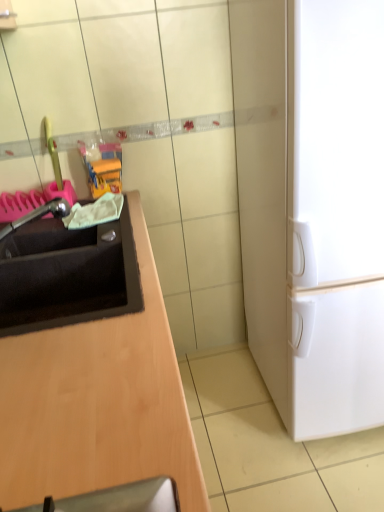
Question: From a real-world perspective, is black matte sink at left physically above white matte refrigerator at right?

Choices:
 (A) yes
 (B) no

Answer: (A)

Question: Is black matte sink at left positioned before white matte refrigerator at right?

Choices:
 (A) yes
 (B) no

Answer: (B)

Question: Is black matte sink at left smaller than white matte refrigerator at right?

Choices:
 (A) yes
 (B) no

Answer: (A)

Question: Is black matte sink at left next to white matte refrigerator at right?

Choices:
 (A) no
 (B) yes

Answer: (A)

Question: Is black matte sink at left aimed at white matte refrigerator at right?

Choices:
 (A) yes
 (B) no

Answer: (A)

Question: From a real-world perspective, relative to satin nickel faucet at left, is white matte refrigerator at right vertically above or below?

Choices:
 (A) above
 (B) below

Answer: (B)

Question: Looking at their shapes, would you say white matte refrigerator at right is wider or thinner than satin nickel faucet at left?

Choices:
 (A) wide
 (B) thin

Answer: (A)

Question: Visually, is white matte refrigerator at right positioned to the left or to the right of satin nickel faucet at left?

Choices:
 (A) left
 (B) right

Answer: (B)

Question: Does point (281, 193) appear closer or farther from the camera than point (31, 215)?

Choices:
 (A) farther
 (B) closer

Answer: (B)

Question: Considering the positions of black matte sink at left and white matte refrigerator at right in the image, is black matte sink at left taller or shorter than white matte refrigerator at right?

Choices:
 (A) short
 (B) tall

Answer: (A)

Question: From a real-world perspective, is black matte sink at left above or below white matte refrigerator at right?

Choices:
 (A) below
 (B) above

Answer: (B)

Question: From the image's perspective, is black matte sink at left positioned above or below white matte refrigerator at right?

Choices:
 (A) below
 (B) above

Answer: (A)

Question: In the image, is black matte sink at left positioned in front of or behind white matte refrigerator at right?

Choices:
 (A) front
 (B) behind

Answer: (B)

Question: In terms of height, does satin nickel faucet at left look taller or shorter compared to black matte sink at left?

Choices:
 (A) short
 (B) tall

Answer: (A)

Question: Visually, is satin nickel faucet at left positioned to the left or to the right of black matte sink at left?

Choices:
 (A) left
 (B) right

Answer: (A)